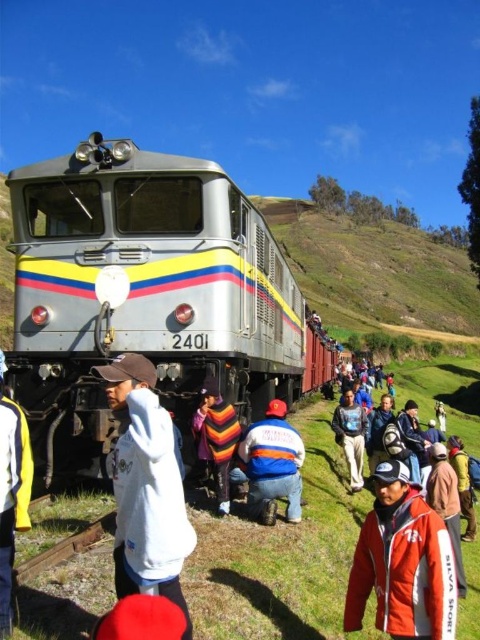
Can you confirm if orange softshell jacket at center is wider than white fleece jacket at lower left?

Yes, orange softshell jacket at center is wider than white fleece jacket at lower left.

Who is more forward, (x=410, y=628) or (x=23, y=472)?

Point (x=23, y=472) is more forward.

Find the location of a particular element. orange softshell jacket at center is located at coordinates (403, 563).

Is silver metallic train at center closer to camera compared to orange softshell jacket at center?

No, silver metallic train at center is further to the viewer.

Does silver metallic train at center have a smaller size compared to orange softshell jacket at center?

Actually, silver metallic train at center might be larger than orange softshell jacket at center.

Is point (273, 365) closer to camera compared to point (365, 593)?

No, it is not.

Identify the location of silver metallic train at center. (147, 292).

Is silver metallic train at center to the left of white fleece jacket at center from the viewer's perspective?

Correct, you'll find silver metallic train at center to the left of white fleece jacket at center.

Is point (58, 208) positioned behind point (134, 520)?

Yes, it is behind point (134, 520).

Identify the location of silver metallic train at center. (147, 292).